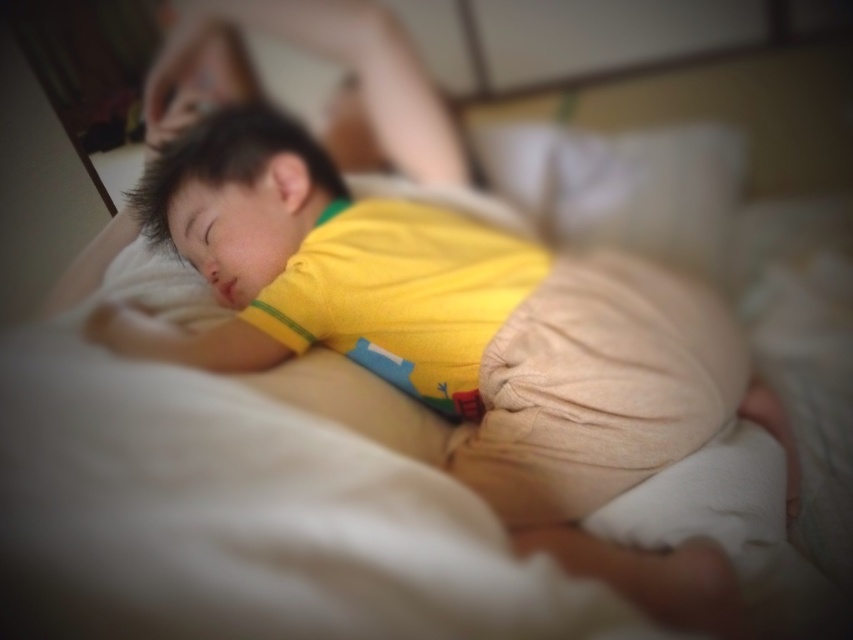
Which is in front, point (270, 116) or point (730, 173)?

Point (270, 116)

Is yellow cotton shirt at center to the right of beige soft pillow at upper center from the viewer's perspective?

In fact, yellow cotton shirt at center is to the left of beige soft pillow at upper center.

Is point (282, 240) farther from viewer compared to point (628, 237)?

No.

Where is `yellow cotton shirt at center`? The width and height of the screenshot is (853, 640). yellow cotton shirt at center is located at coordinates (349, 278).